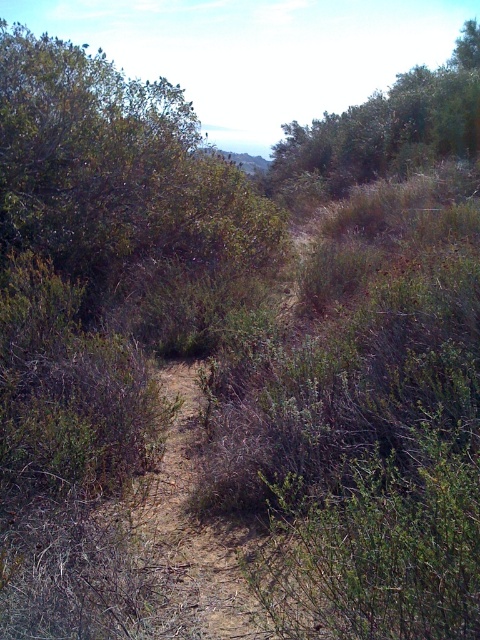
Measure the distance from green leafy bush at center to green leafy tree at upper right.

green leafy bush at center and green leafy tree at upper right are 10.45 meters apart.

Is green leafy bush at center in front of green leafy tree at upper right?

Yes, green leafy bush at center is in front of green leafy tree at upper right.

Measure the distance between green leafy bush at center and camera.

8.60 meters

This screenshot has width=480, height=640. I want to click on green leafy bush at center, so click(117, 176).